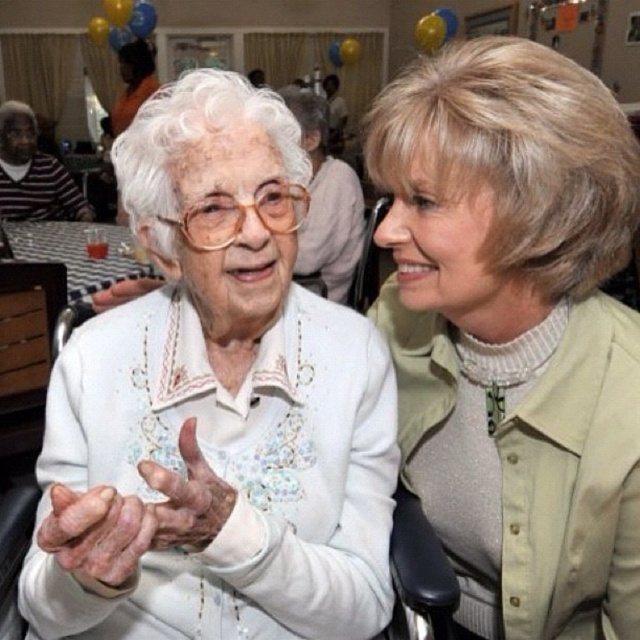
Question: Which point is closer to the camera?

Choices:
 (A) white matte hand at center
 (B) dry skin hand at center
 (C) dry wrinkled hand at center
 (D) light beige sweater at center

Answer: (C)

Question: Does light beige sweater at center appear over dry skin hand at center?

Choices:
 (A) no
 (B) yes

Answer: (B)

Question: Can you confirm if light beige sweater at center is bigger than dry skin hand at center?

Choices:
 (A) yes
 (B) no

Answer: (A)

Question: Which object appears closest to the camera in this image?

Choices:
 (A) white matte hand at center
 (B) light beige sweater at center
 (C) dry wrinkled hand at center
 (D) dry skin hand at center

Answer: (C)

Question: Does light beige sweater at center lie in front of dry skin hand at center?

Choices:
 (A) yes
 (B) no

Answer: (B)

Question: Which object appears farthest from the camera in this image?

Choices:
 (A) dry wrinkled hand at center
 (B) white matte hand at center

Answer: (B)